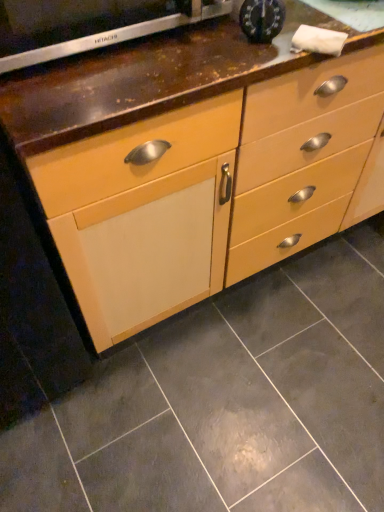
Identify the location of vacant area that lies in front of metallic clock at upper center, which ranks as the 1th appliance in right-to-left order. This screenshot has width=384, height=512. (243, 62).